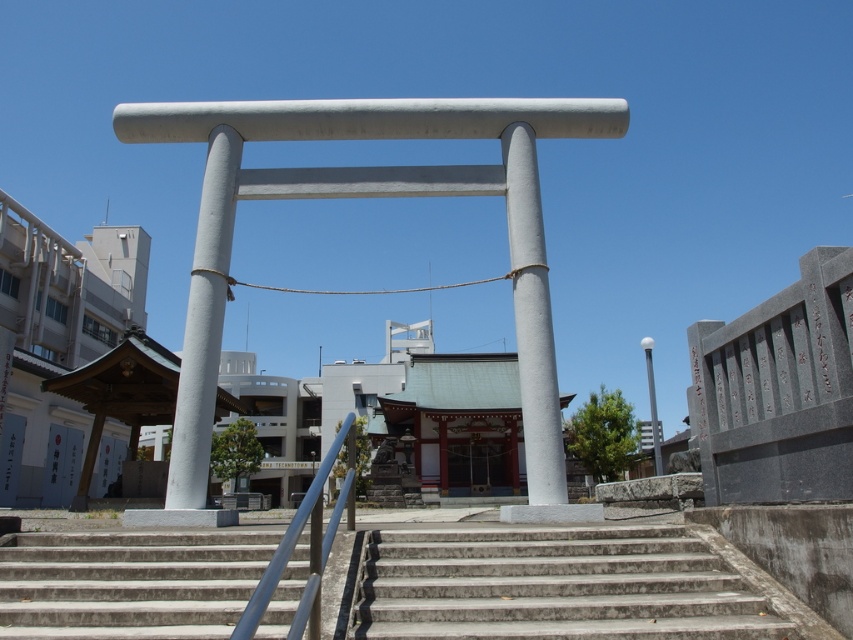
Is point (523, 433) behind point (643, 349)?

Yes, point (523, 433) is behind point (643, 349).

Which is more to the left, smooth concrete pillar at center or smooth gray pole at right?

Positioned to the left is smooth concrete pillar at center.

Is point (527, 301) positioned in front of point (654, 442)?

Yes.

Identify the location of smooth concrete pillar at center. (532, 317).

Consider the image. Does concrete stairs at center appear on the left side of smooth concrete pillar at left?

In fact, concrete stairs at center is to the right of smooth concrete pillar at left.

Who is lower down, concrete stairs at center or smooth concrete pillar at left?

concrete stairs at center

Image resolution: width=853 pixels, height=640 pixels. I want to click on concrete stairs at center, so click(x=128, y=582).

Does point (173, 451) come behind point (527, 211)?

No, (173, 451) is closer to viewer.

How much distance is there between smooth concrete pillar at left and smooth concrete pillar at center?

smooth concrete pillar at left is 17.42 feet away from smooth concrete pillar at center.

Identify the location of smooth concrete pillar at left. (204, 323).